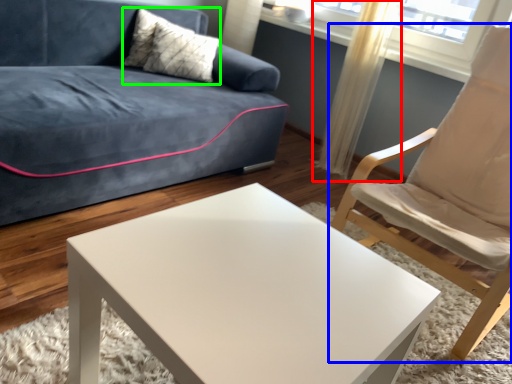
Question: Estimate the real-world distances between objects in this image. Which object is closer to curtain (highlighted by a red box), chair (highlighted by a blue box) or pillow (highlighted by a green box)?

Choices:
 (A) chair
 (B) pillow

Answer: (A)